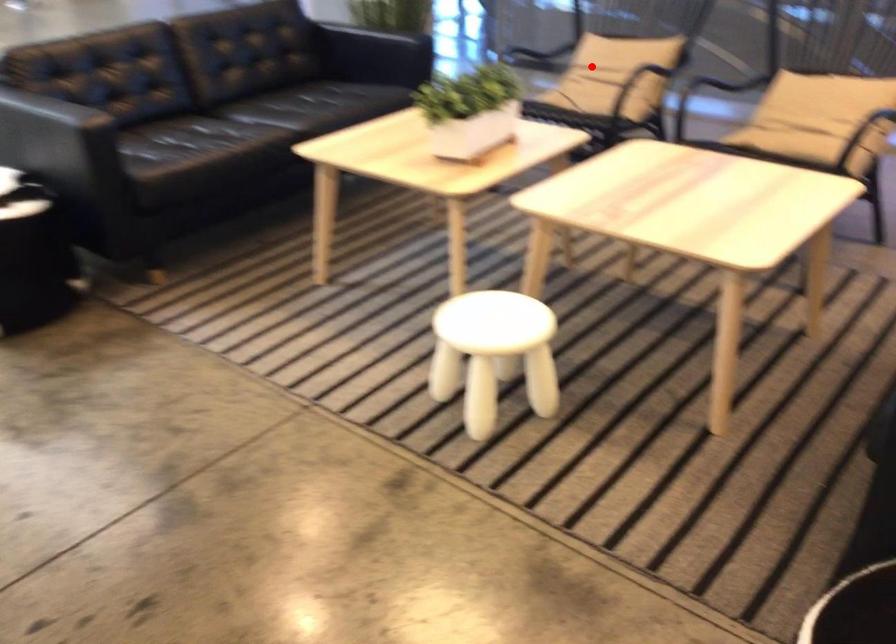
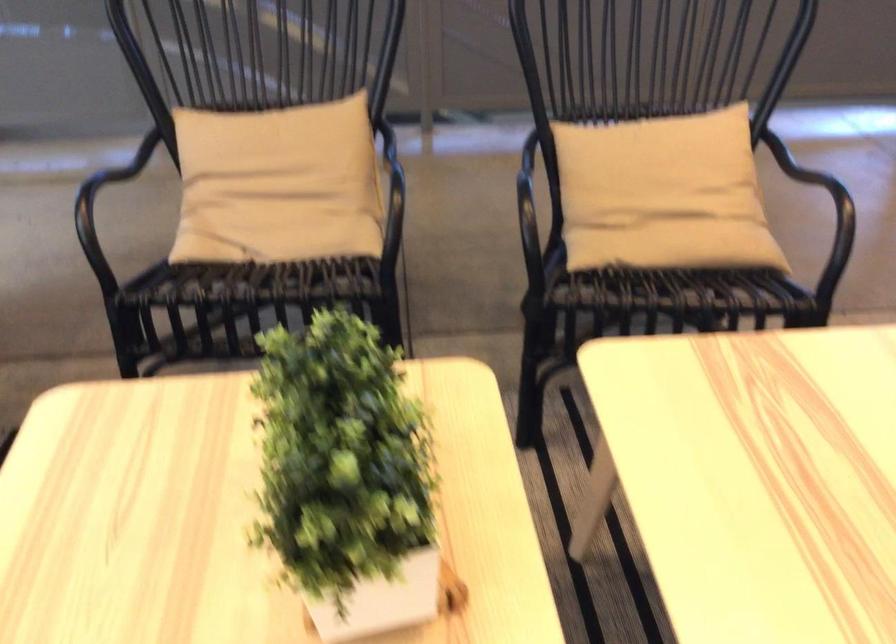
In the second image, find the point that corresponds to the highlighted location in the first image.

(278, 184)